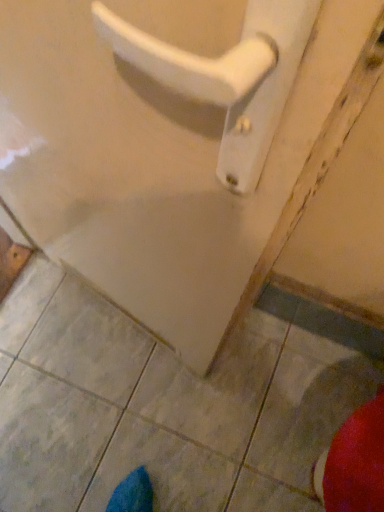
This screenshot has width=384, height=512. Describe the element at coordinates (161, 407) in the screenshot. I see `gray matte tile at center` at that location.

The image size is (384, 512). I want to click on gray matte tile at center, so click(161, 407).

Identify the location of gray matte tile at center. Image resolution: width=384 pixels, height=512 pixels. (161, 407).